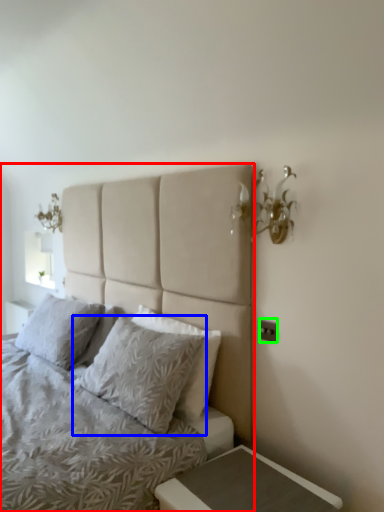
Question: Which object is the closest to the bed (highlighted by a red box)? Choose among these: pillow (highlighted by a blue box) or electric outlet (highlighted by a green box).

Choices:
 (A) pillow
 (B) electric outlet

Answer: (A)